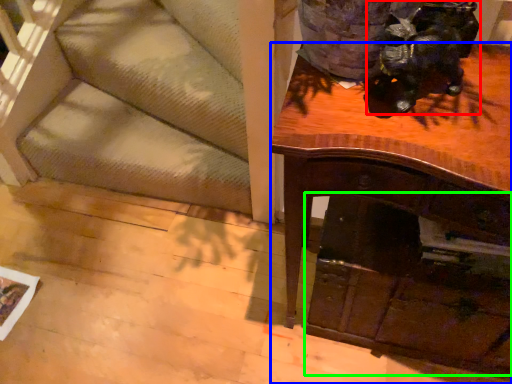
Question: Which object is the closest to the animal (highlighted by a red box)? Choose among these: desk (highlighted by a blue box) or drawer (highlighted by a green box).

Choices:
 (A) desk
 (B) drawer

Answer: (A)